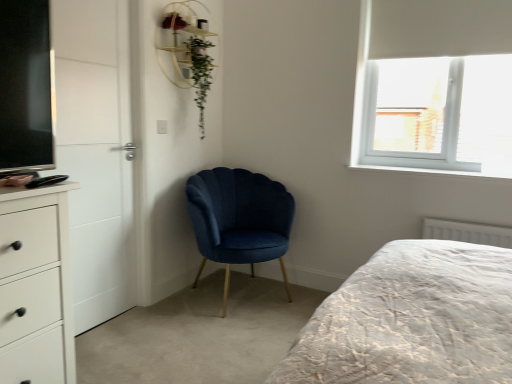
You are a GUI agent. You are given a task and a screenshot of the screen. Output one action in this format:
    pyautogui.click(x=<x>, y=<y>)
    Task: Click on the vacant region above white textured radiator at lower right (from a real-world perspective)
    Image resolution: width=512 pixels, height=384 pixels.
    Given the screenshot: What is the action you would take?
    click(x=467, y=217)